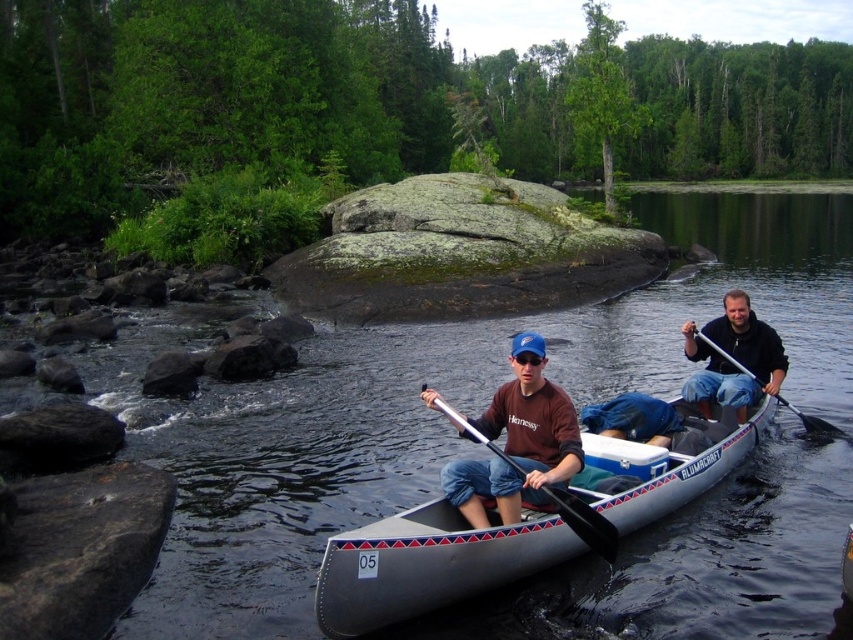
You are a photographer trying to capture a photo of the clear water at center and the dark blue jeans at center. Which object should you focus on first if you want to capture both in one shot without moving the camera?

The clear water at center is to the right of dark blue jeans at center, so you should focus on the dark blue jeans at center first to ensure both are in frame without moving the camera.

You are a photographer trying to capture a clear shot of the matte brown shirt at center and the silver metallic paddle at center. Since you want both objects in focus, which one should you adjust your camera focus on first?

The matte brown shirt at center is closer to the viewer than the silver metallic paddle at center, so you should focus on the matte brown shirt at center first to ensure both are in focus.